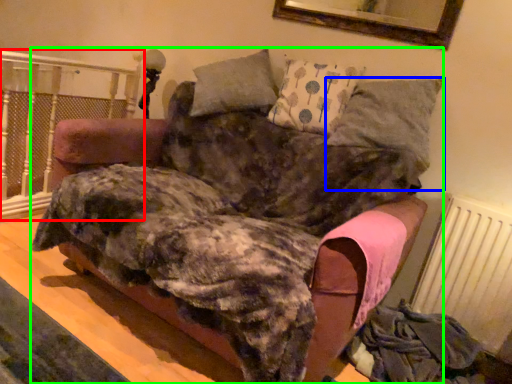
Question: Which object is the closest to the rail (highlighted by a red box)? Choose among these: pillow (highlighted by a blue box) or furniture (highlighted by a green box).

Choices:
 (A) pillow
 (B) furniture

Answer: (B)